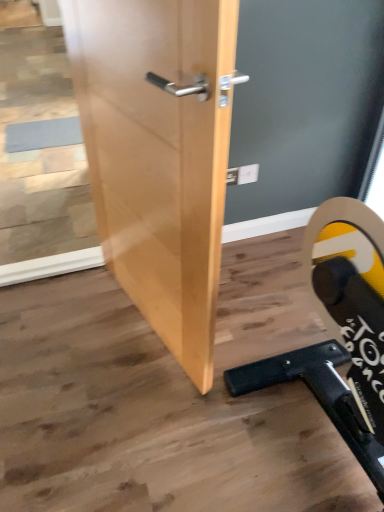
Identify the location of vacant area to the left of natural wood door at center. The width and height of the screenshot is (384, 512). (65, 328).